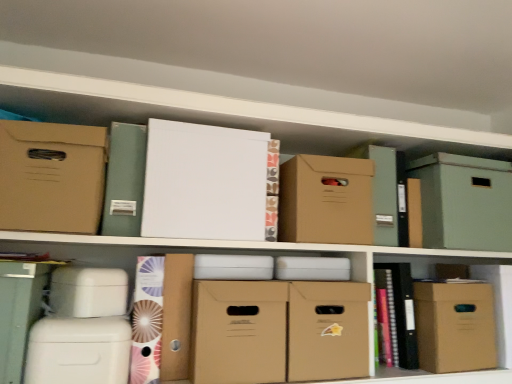
This screenshot has height=384, width=512. What do you see at coordinates (326, 200) in the screenshot? I see `matte brown cardboard box at upper center, placed as the 5th cardboard box when sorted from left to right` at bounding box center [326, 200].

This screenshot has width=512, height=384. What do you see at coordinates (124, 180) in the screenshot? I see `matte green file at upper left, the first book from the top` at bounding box center [124, 180].

Identify the location of matte green file at upper left, the first book from the top. This screenshot has width=512, height=384. (124, 180).

Locate an element on the screen. The width and height of the screenshot is (512, 384). matte cardboard box at lower right is located at coordinates (495, 312).

What is the approximate width of matte brown cardboard box at upper left, arranged as the 7th cardboard box when viewed from the right?

It is 20.68 centimeters.

The image size is (512, 384). Describe the element at coordinates (204, 182) in the screenshot. I see `white cardboard box at upper center, the second cardboard box positioned from the left` at that location.

How much space does white cardboard box at upper center, the second cardboard box positioned from the left, occupy horizontally?

The width of white cardboard box at upper center, the second cardboard box positioned from the left, is 32.58 centimeters.

This screenshot has width=512, height=384. Describe the element at coordinates (464, 202) in the screenshot. I see `green cardboard box at upper right, the sixth cardboard box viewed from the left` at that location.

Image resolution: width=512 pixels, height=384 pixels. I want to click on patterned paper folder at lower left, the 2th book when ordered from top to bottom, so click(x=147, y=320).

Measure the distance between brown cardboard box at upper center and camera.

brown cardboard box at upper center and camera are 1.32 meters apart from each other.

Find the location of a particular element. matte brown cardboard box at upper center, acting as the 3th cardboard box starting from the right is located at coordinates (326, 200).

Is patterned paper folder at lower left, the 2th book when ordered from top to bottom, wider than brown cardboard box at upper center?

In fact, patterned paper folder at lower left, the 2th book when ordered from top to bottom, might be narrower than brown cardboard box at upper center.

From a real-world perspective, who is located lower, patterned paper folder at lower left, the first book from the bottom, or brown cardboard box at upper center?

patterned paper folder at lower left, the first book from the bottom, from a real-world perspective.

Is patterned paper folder at lower left, the 2th book when ordered from top to bottom, far from brown cardboard box at upper center?

They are positioned close to each other.

Could you tell me if brown cardboard box at upper center is facing white cardboard box at upper center, the sixth cardboard box from the right?

No, brown cardboard box at upper center is not oriented towards white cardboard box at upper center, the sixth cardboard box from the right.

From a real-world perspective, which is physically above, brown cardboard box at upper center or white cardboard box at upper center, the second cardboard box positioned from the left?

From a 3D spatial view, brown cardboard box at upper center is above.

Considering the sizes of objects brown cardboard box at upper center and white cardboard box at upper center, the sixth cardboard box from the right, in the image provided, who is smaller, brown cardboard box at upper center or white cardboard box at upper center, the sixth cardboard box from the right,?

brown cardboard box at upper center.

Looking at this image, which is more to the right, brown cardboard box at upper center or white cardboard box at upper center, the second cardboard box positioned from the left?

Positioned to the right is brown cardboard box at upper center.

Looking at this image, is white cardboard box at upper center, the second cardboard box positioned from the left, looking in the opposite direction of matte brown cardboard box at lower right, the first cardboard box viewed from the right?

No, matte brown cardboard box at lower right, the first cardboard box viewed from the right, is not at the back of white cardboard box at upper center, the second cardboard box positioned from the left.

From a real-world perspective, does white cardboard box at upper center, the sixth cardboard box from the right, sit lower than matte brown cardboard box at lower right, the first cardboard box viewed from the right?

No, from a real-world perspective, white cardboard box at upper center, the sixth cardboard box from the right, is not beneath matte brown cardboard box at lower right, the first cardboard box viewed from the right.

Measure the distance from white cardboard box at upper center, the sixth cardboard box from the right, to matte brown cardboard box at lower right, the first cardboard box viewed from the right.

white cardboard box at upper center, the sixth cardboard box from the right, and matte brown cardboard box at lower right, the first cardboard box viewed from the right, are 27.96 inches apart from each other.

This screenshot has width=512, height=384. Find the location of `the 5th cardboard box counting from the right side of the white cardboard box at upper center, the sixth cardboard box from the right`. the 5th cardboard box counting from the right side of the white cardboard box at upper center, the sixth cardboard box from the right is located at coordinates (455, 326).

Looking at this image, is white matte storage box at lower left not near matte brown cardboard box at center, which appears as the fourth cardboard box when viewed from the right?

No, white matte storage box at lower left is not far away from matte brown cardboard box at center, which appears as the fourth cardboard box when viewed from the right.

Based on the photo, from a real-world perspective, is white matte storage box at lower left located higher than matte brown cardboard box at center, which appears as the fourth cardboard box when viewed from the right?

Yes, from a real-world perspective, white matte storage box at lower left is over matte brown cardboard box at center, which appears as the fourth cardboard box when viewed from the right

Find the location of a particular element. This screenshot has width=512, height=384. cardboard box that is the 4th object located behind the white matte storage box at lower left is located at coordinates (328, 330).

Is white matte storage box at lower left positioned with its back to matte brown cardboard box at center, which appears as the fourth cardboard box when viewed from the right?

No, white matte storage box at lower left's orientation is not away from matte brown cardboard box at center, which appears as the fourth cardboard box when viewed from the right.

Could you tell me if matte brown cardboard box at upper center, placed as the 5th cardboard box when sorted from left to right, is turned towards green cardboard box at upper right, which is the second cardboard box in right-to-left order?

No.

Considering the points (318, 207) and (493, 198), which point is in front, point (318, 207) or point (493, 198)?

Point (318, 207)

Can you confirm if matte brown cardboard box at upper center, acting as the 3th cardboard box starting from the right, is positioned to the right of green cardboard box at upper right, which is the second cardboard box in right-to-left order?

No, matte brown cardboard box at upper center, acting as the 3th cardboard box starting from the right, is not to the right of green cardboard box at upper right, which is the second cardboard box in right-to-left order.

Which object is more forward, matte brown cardboard box at upper center, placed as the 5th cardboard box when sorted from left to right, or white cardboard box at upper center, the second cardboard box positioned from the left?

Positioned in front is white cardboard box at upper center, the second cardboard box positioned from the left.

Between matte brown cardboard box at upper center, acting as the 3th cardboard box starting from the right, and white cardboard box at upper center, the sixth cardboard box from the right, which one appears on the left side from the viewer's perspective?

white cardboard box at upper center, the sixth cardboard box from the right, is more to the left.

Considering the relative sizes of matte brown cardboard box at upper center, acting as the 3th cardboard box starting from the right, and white cardboard box at upper center, the sixth cardboard box from the right, in the image provided, is matte brown cardboard box at upper center, acting as the 3th cardboard box starting from the right, bigger than white cardboard box at upper center, the sixth cardboard box from the right,?

No.

Considering the relative sizes of matte brown cardboard box at upper center, placed as the 5th cardboard box when sorted from left to right, and white cardboard box at upper center, the second cardboard box positioned from the left, in the image provided, is matte brown cardboard box at upper center, placed as the 5th cardboard box when sorted from left to right, taller than white cardboard box at upper center, the second cardboard box positioned from the left,?

No, matte brown cardboard box at upper center, placed as the 5th cardboard box when sorted from left to right, is not taller than white cardboard box at upper center, the second cardboard box positioned from the left.

Is matte cardboard box at lower right not within matte brown cardboard box at lower right, which is the 7th cardboard box from left to right?

Yes.

Does matte cardboard box at lower right turn towards matte brown cardboard box at lower right, which is the 7th cardboard box from left to right?

No.

From the image's perspective, is matte cardboard box at lower right located beneath matte brown cardboard box at lower right, which is the 7th cardboard box from left to right?

Yes, from the image's perspective, matte cardboard box at lower right is beneath matte brown cardboard box at lower right, which is the 7th cardboard box from left to right.

From a real-world perspective, is matte cardboard box at lower right physically located above or below matte brown cardboard box at lower right, the first cardboard box viewed from the right?

matte cardboard box at lower right is below matte brown cardboard box at lower right, the first cardboard box viewed from the right.

This screenshot has height=384, width=512. Identify the location of box above the patterned paper folder at lower left, the first book from the bottom (from a real-world perspective). (384, 190).

Find the location of `box on the right of white cardboard box at upper center, the sixth cardboard box from the right`. box on the right of white cardboard box at upper center, the sixth cardboard box from the right is located at coordinates pos(384,190).

Estimate the real-world distances between objects in this image. Which object is closer to matte brown cardboard box at center, arranged as the fifth cardboard box when viewed from the right, matte brown cardboard box at upper left, arranged as the 7th cardboard box when viewed from the right, or matte brown cardboard box at lower right, the first cardboard box viewed from the right?

matte brown cardboard box at upper left, arranged as the 7th cardboard box when viewed from the right, is closer to matte brown cardboard box at center, arranged as the fifth cardboard box when viewed from the right.

Estimate the real-world distances between objects in this image. Which object is further from matte brown cardboard box at upper center, placed as the 5th cardboard box when sorted from left to right, matte brown cardboard box at upper left, which is the first cardboard box from left to right, or patterned paper folder at lower left, the first book from the bottom?

Based on the image, matte brown cardboard box at upper left, which is the first cardboard box from left to right, appears to be further to matte brown cardboard box at upper center, placed as the 5th cardboard box when sorted from left to right.

Looking at the image, which one is located closer to matte brown cardboard box at lower right, which is the 7th cardboard box from left to right, matte brown cardboard box at upper left, which is the first cardboard box from left to right, or matte brown cardboard box at center, placed as the fourth cardboard box when sorted from left to right?

Based on the image, matte brown cardboard box at center, placed as the fourth cardboard box when sorted from left to right, appears to be nearer to matte brown cardboard box at lower right, which is the 7th cardboard box from left to right.

In the scene shown: Estimate the real-world distances between objects in this image. Which object is further from matte cardboard box at lower right, white cardboard box at upper center, the second cardboard box positioned from the left, or brown cardboard box at upper center?

Based on the image, white cardboard box at upper center, the second cardboard box positioned from the left, appears to be further to matte cardboard box at lower right.

Based on the photo, looking at the image, which one is located closer to matte brown cardboard box at center, which appears as the fourth cardboard box when viewed from the right, green cardboard box at upper right, the sixth cardboard box viewed from the left, or matte brown cardboard box at upper center, acting as the 3th cardboard box starting from the right?

matte brown cardboard box at upper center, acting as the 3th cardboard box starting from the right, is closer to matte brown cardboard box at center, which appears as the fourth cardboard box when viewed from the right.

Based on their spatial positions, is matte green file at upper left, which is counted as the second book, starting from the bottom, or white matte storage box at lower left closer to green cardboard box at upper right, which is the second cardboard box in right-to-left order?

matte green file at upper left, which is counted as the second book, starting from the bottom.

Looking at the image, which one is located further to matte brown cardboard box at upper center, placed as the 5th cardboard box when sorted from left to right, matte brown cardboard box at upper left, which is the first cardboard box from left to right, or brown cardboard box at upper center?

Among the two, matte brown cardboard box at upper left, which is the first cardboard box from left to right, is located further to matte brown cardboard box at upper center, placed as the 5th cardboard box when sorted from left to right.

Which object lies further to the anchor point brown cardboard box at upper center, matte brown cardboard box at upper center, acting as the 3th cardboard box starting from the right, or matte cardboard box at lower right?

matte cardboard box at lower right lies further to brown cardboard box at upper center than the other object.

The width and height of the screenshot is (512, 384). In order to click on book between matte brown cardboard box at upper left, which is the first cardboard box from left to right, and white matte storage box at lower left, in the vertical direction in this screenshot , I will do `click(124, 180)`.

Identify the location of cardboard box between matte brown cardboard box at center, placed as the fourth cardboard box when sorted from left to right, and green cardboard box at upper right, which is the second cardboard box in right-to-left order, in the horizontal direction. The image size is (512, 384). (326, 200).

Where is `box situated between matte brown cardboard box at center, arranged as the fifth cardboard box when viewed from the right, and green cardboard box at upper right, which is the second cardboard box in right-to-left order, from left to right`? Image resolution: width=512 pixels, height=384 pixels. box situated between matte brown cardboard box at center, arranged as the fifth cardboard box when viewed from the right, and green cardboard box at upper right, which is the second cardboard box in right-to-left order, from left to right is located at coordinates (384, 190).

Where is `box situated between matte green file at upper left, which is counted as the second book, starting from the bottom, and green cardboard box at upper right, the sixth cardboard box viewed from the left, from left to right`? This screenshot has width=512, height=384. box situated between matte green file at upper left, which is counted as the second book, starting from the bottom, and green cardboard box at upper right, the sixth cardboard box viewed from the left, from left to right is located at coordinates (384, 190).